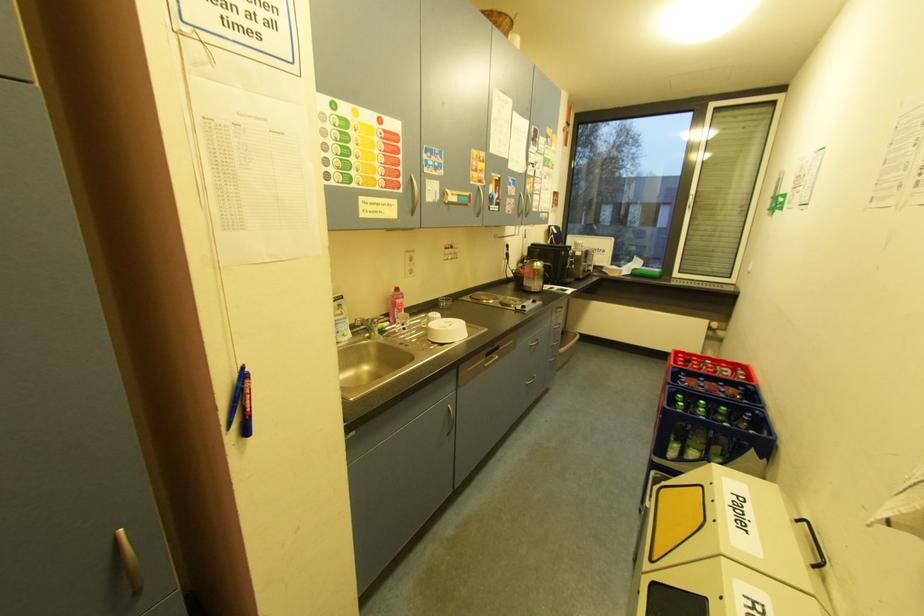
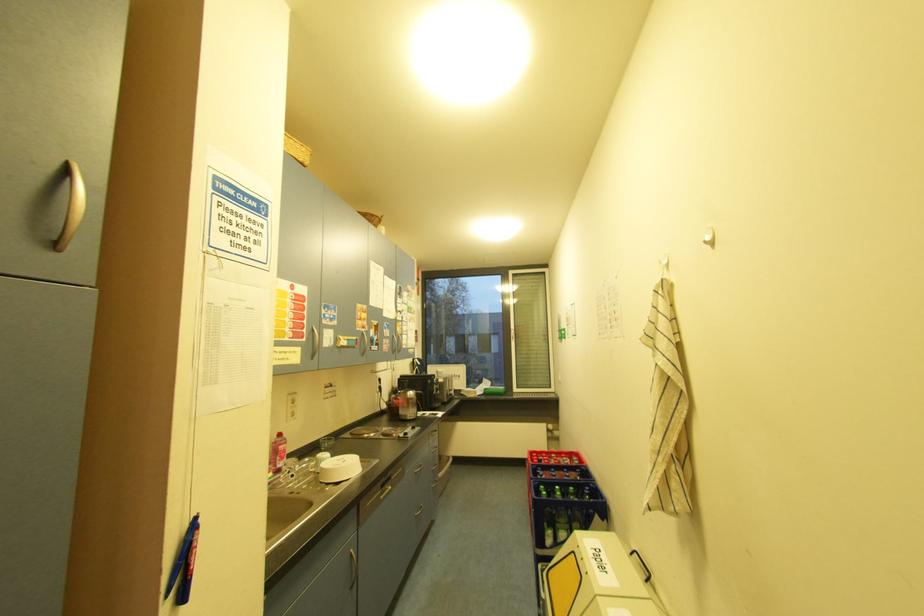
How did the camera likely rotate?

The camera's rotation is toward right-up.